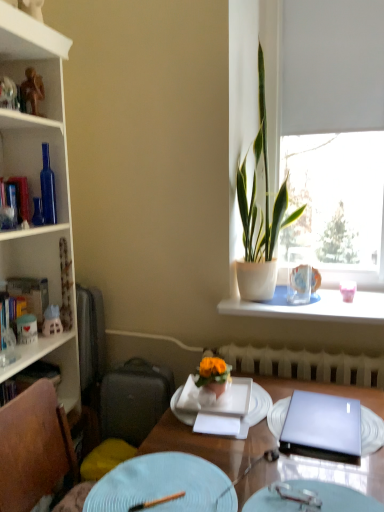
Find the location of a particular element. This screenshot has height=512, width=384. free spot in front of white glossy plate at center, which is the third plate from front to back is located at coordinates (x=256, y=474).